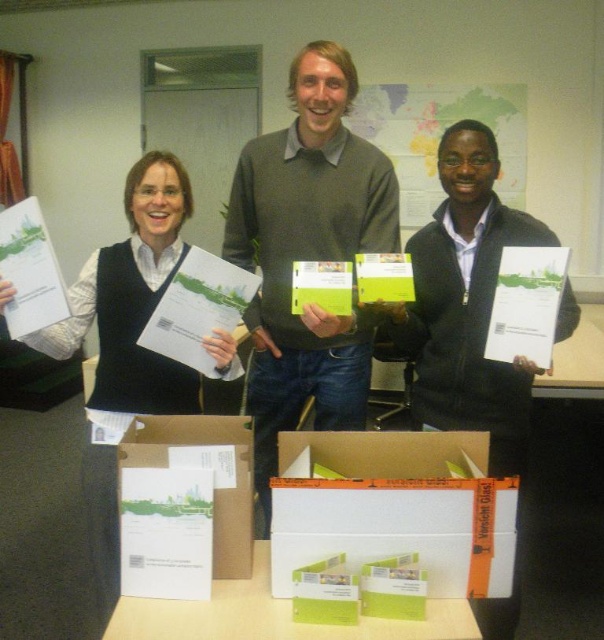
You are organizing a certificate distribution event and need to place a white cardboard box at center in the office. According to the image, where should you position the box to ensure it is exactly at the center of the three people?

The white cardboard box at center should be placed at the coordinates point (184, 504) to ensure it is exactly at the center of the three people.

You are organizing a small event and need to place a white cardboard box at center and a map paper at center on a table. The table has limited vertical space. Which object should you place first to ensure both fit vertically?

Since the white cardboard box at center is not as tall as the map paper at center, you should place the taller map paper at center first to ensure both fit within the table height.